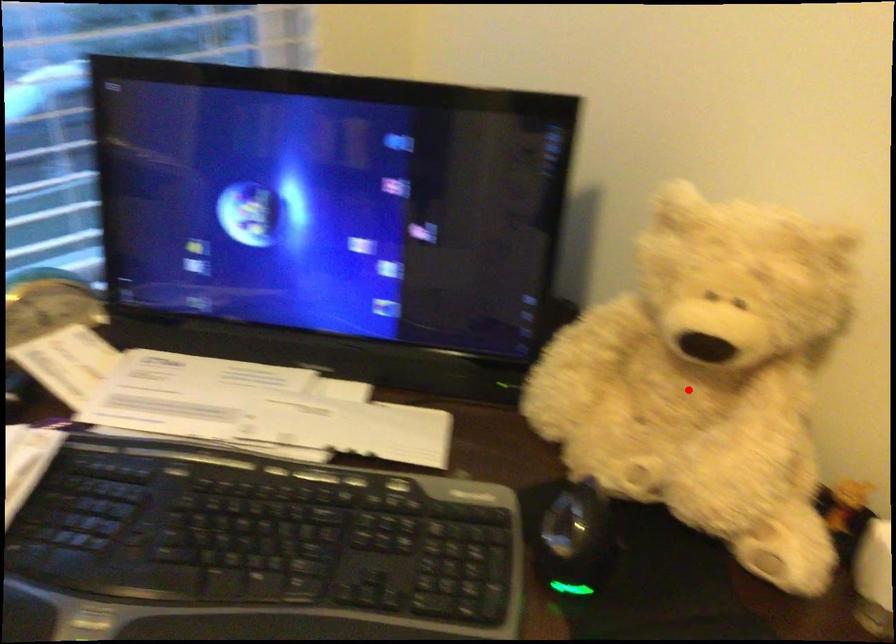
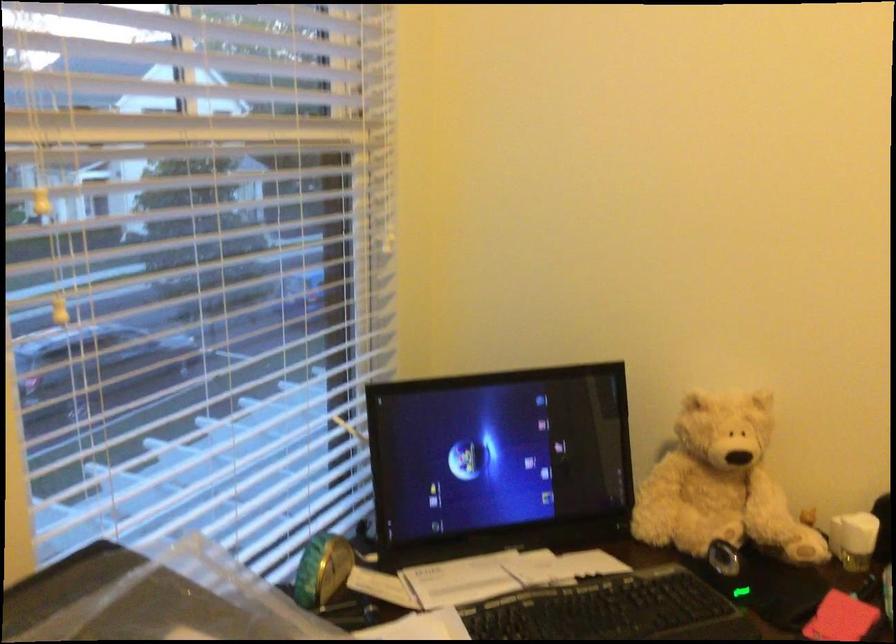
Locate, in the second image, the point that corresponds to the highlighted location in the first image.

(720, 484)